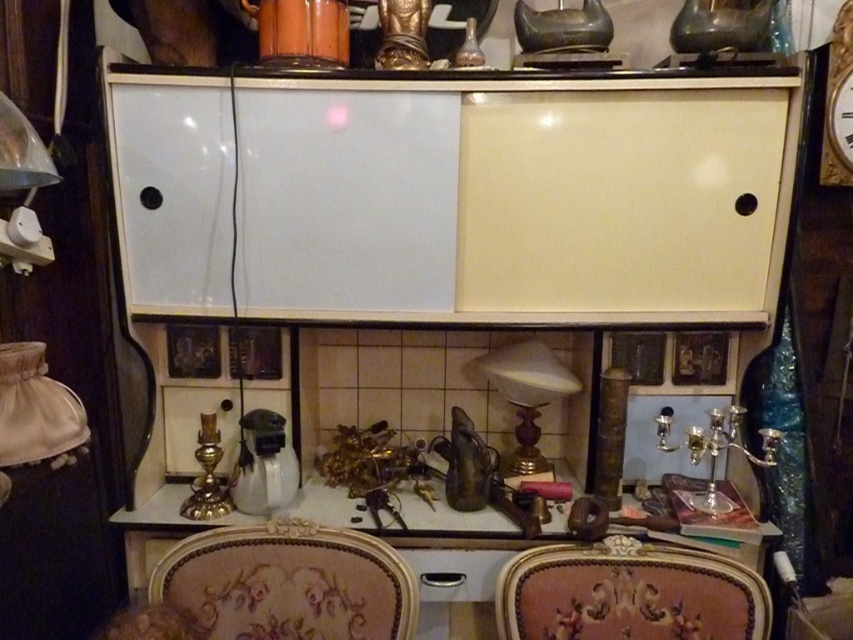
You are a decorator planning to hang a large mirror that requires a sturdy wall space. You notice the white glossy cabinet at upper center and the metallic silver drawer at center. Which object provides a more suitable location for hanging the mirror based on their height?

The white glossy cabinet at upper center is much taller than the metallic silver drawer at center, making it a more suitable location for hanging the mirror due to its height providing better support and visibility.

From the picture: You are a guest entering the room and want to sit down. Which chair, the velvet upholstered chair at lower center or the velvet floral chair at center, would be more comfortable for someone who prefers a higher seat?

The velvet upholstered chair at lower center is much taller than the velvet floral chair at center, so it would be more comfortable for someone who prefers a higher seat.

You are organizing a dinner party and need to place a centerpiece on the table between the velvet floral chair at center and the matte glass lamp at center. According to the scene, which side of the lamp should you place it to ensure it aligns with the existing arrangement?

The velvet floral chair at center is positioned on the right side of matte glass lamp at center, so the centerpiece should be placed to the right of the matte glass lamp at center to align with the existing arrangement.